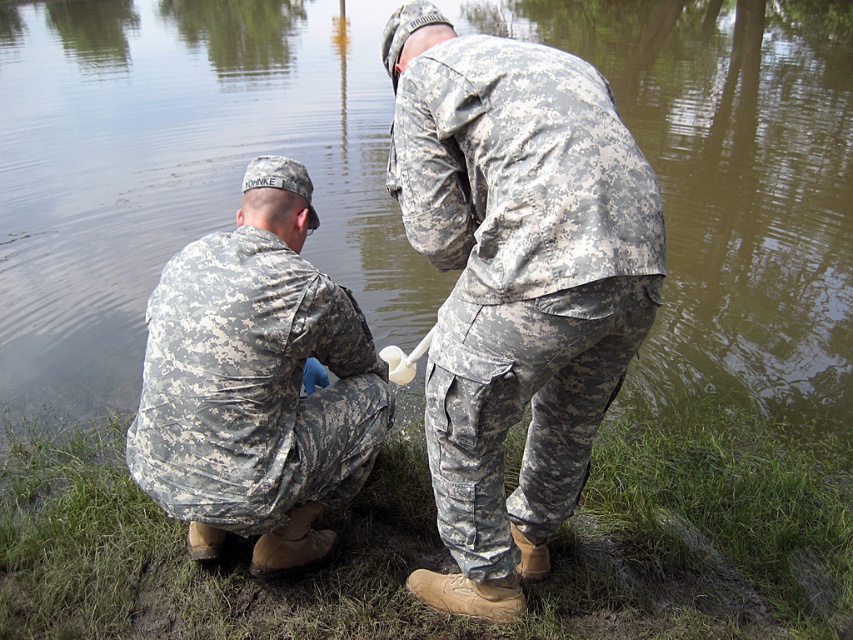
Who is positioned more to the right, camouflage fabric pants at lower center or camouflage fabric uniform at left?

From the viewer's perspective, camouflage fabric pants at lower center appears more on the right side.

Does camouflage fabric pants at lower center have a lesser width compared to camouflage fabric uniform at left?

Yes.

Between point (577, 269) and point (273, 429), which one is positioned behind?

Positioned behind is point (273, 429).

Find the location of a particular element. camouflage fabric pants at lower center is located at coordinates (515, 282).